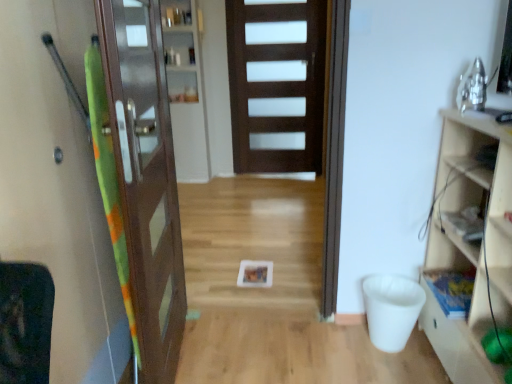
Question: Is wooden cabinet at right bigger or smaller than brown wooden door at left, the 2th door in the back-to-front sequence?

Choices:
 (A) big
 (B) small

Answer: (A)

Question: Choose the correct answer: Is wooden cabinet at right inside brown wooden door at left, the 2th door in the back-to-front sequence, or outside it?

Choices:
 (A) outside
 (B) inside

Answer: (A)

Question: Based on their relative distances, which object is nearer to the wooden cabinet at right?

Choices:
 (A) wooden bookshelf at right, arranged as the 1th shelf when ordered from the bottom
 (B) green fabric screen door at left
 (C) brown wooden door at left, which ranks as the 1th door in front-to-back order
 (D) clear glass cabinet at center, which is the 2th shelf in right-to-left order
 (E) dark wood door at center, acting as the 1th door starting from the back

Answer: (A)

Question: Estimate the real-world distances between objects in this image. Which object is closer to the clear glass cabinet at center, which ranks as the second shelf in front-to-back order?

Choices:
 (A) brown wooden door at left, the first door from the left
 (B) dark wood door at center, acting as the 1th door starting from the back
 (C) wooden bookshelf at right, placed as the 2th shelf when sorted from back to front
 (D) wooden cabinet at right
 (E) green fabric screen door at left

Answer: (B)